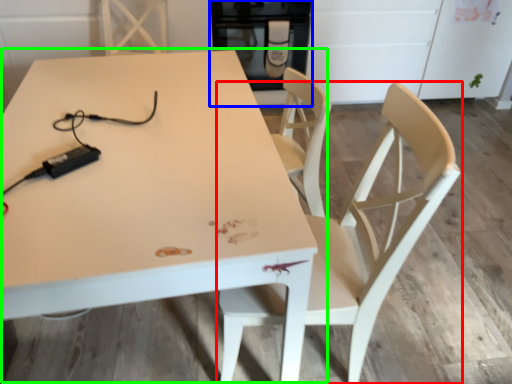
Question: Estimate the real-world distances between objects in this image. Which object is closer to chair (highlighted by a red box), appliance (highlighted by a blue box) or table (highlighted by a green box)?

Choices:
 (A) appliance
 (B) table

Answer: (B)